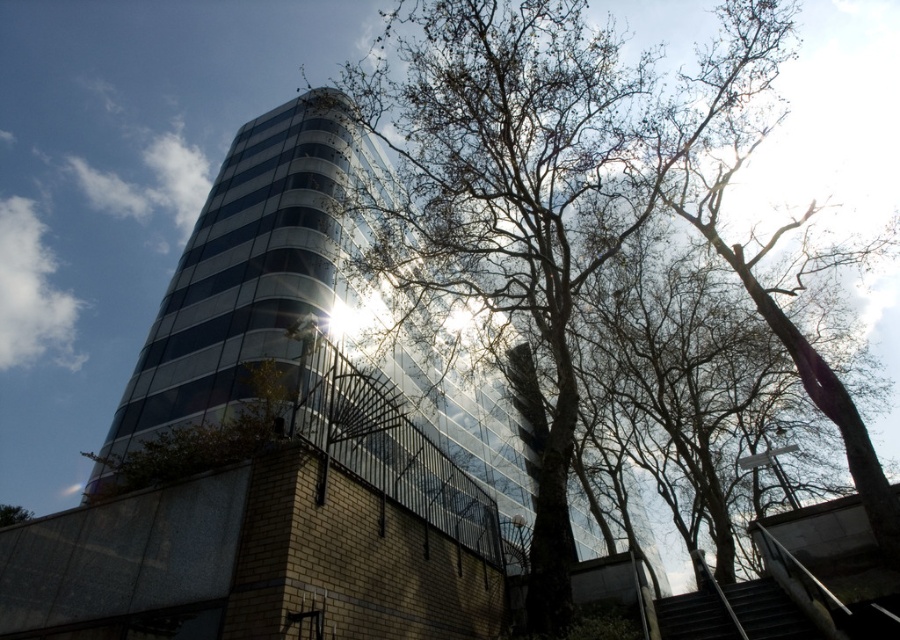
Question: Is bare branches at center above dark gray metal stairs at lower right?

Choices:
 (A) no
 (B) yes

Answer: (B)

Question: Among these points, which one is farthest from the camera?

Choices:
 (A) (677, 616)
 (B) (483, 42)

Answer: (B)

Question: Where is bare branches at center located in relation to dark gray metal stairs at lower right in the image?

Choices:
 (A) below
 (B) above

Answer: (B)

Question: Which point is closer to the camera?

Choices:
 (A) bare branches at center
 (B) dark gray metal stairs at lower right

Answer: (B)

Question: Which of the following is the farthest from the observer?

Choices:
 (A) (698, 156)
 (B) (700, 605)

Answer: (A)

Question: From the image, what is the correct spatial relationship of bare branches at center in relation to dark gray metal stairs at lower right?

Choices:
 (A) below
 (B) above

Answer: (B)